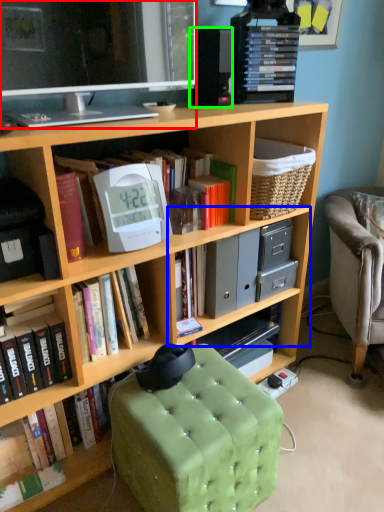
Question: Which object is positioned farthest from television (highlighted by a red box)? Select from cabinet (highlighted by a blue box) and speaker (highlighted by a green box).

Choices:
 (A) cabinet
 (B) speaker

Answer: (A)